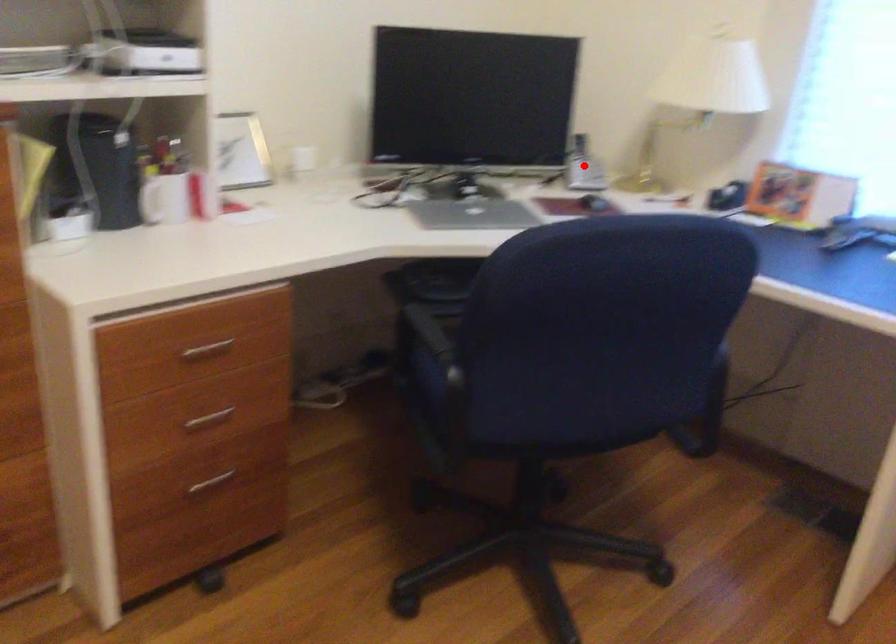
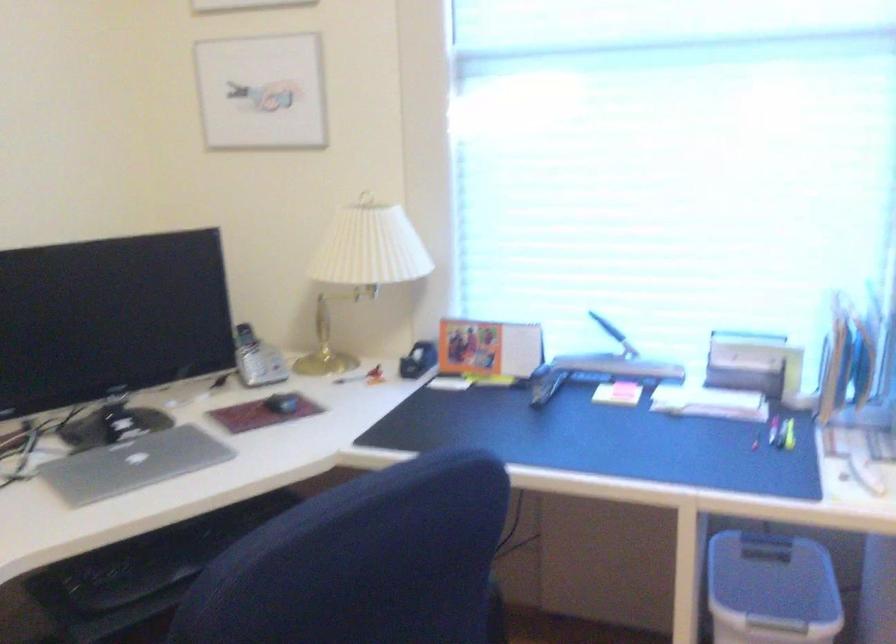
Question: I am providing you with two images of the same scene from different viewpoints. A red point is shown in image1. For the corresponding object point in image2, is it positioned nearer or farther from the camera?

Choices:
 (A) Nearer
 (B) Farther

Answer: (A)